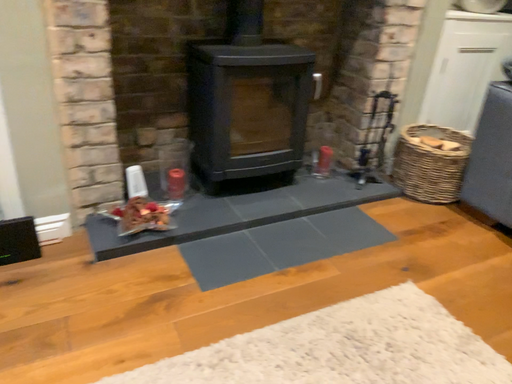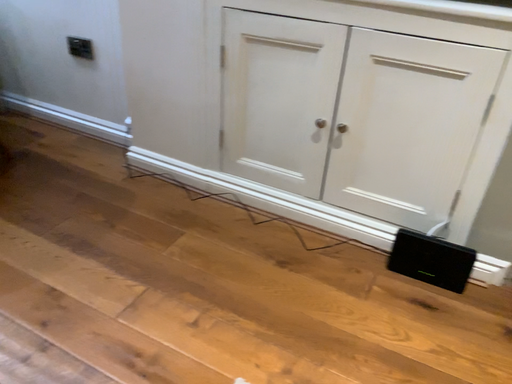
Question: How did the camera likely rotate when shooting the video?

Choices:
 (A) rotated downward
 (B) rotated upward

Answer: (B)